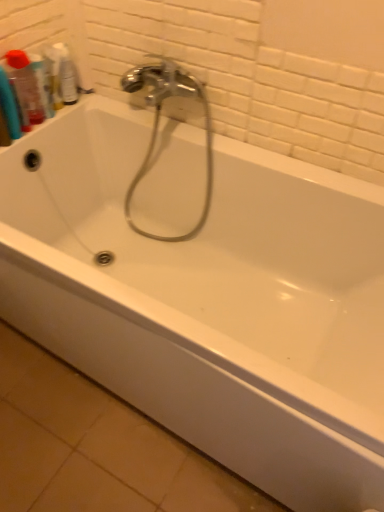
Question: From a real-world perspective, is translucent plastic mouthwash at upper left, which ranks as the first mouthwash in left-to-right order, positioned under translucent plastic mouthwash at upper left, arranged as the 2th mouthwash when viewed from the left, based on gravity?

Choices:
 (A) yes
 (B) no

Answer: (B)

Question: Considering the relative positions of translucent plastic mouthwash at upper left, which ranks as the first mouthwash in left-to-right order, and translucent plastic mouthwash at upper left, arranged as the second mouthwash when viewed from the right, in the image provided, is translucent plastic mouthwash at upper left, which ranks as the first mouthwash in left-to-right order, behind translucent plastic mouthwash at upper left, arranged as the second mouthwash when viewed from the right,?

Choices:
 (A) no
 (B) yes

Answer: (A)

Question: Is translucent plastic mouthwash at upper left, arranged as the 2th mouthwash when viewed from the left, located within translucent plastic mouthwash at upper left, which ranks as the first mouthwash in left-to-right order?

Choices:
 (A) no
 (B) yes

Answer: (A)

Question: Is translucent plastic mouthwash at upper left, which ranks as the first mouthwash in left-to-right order, aimed at translucent plastic mouthwash at upper left, arranged as the second mouthwash when viewed from the right?

Choices:
 (A) yes
 (B) no

Answer: (B)

Question: Is translucent plastic mouthwash at upper left, the 3th mouthwash in the right-to-left sequence, at the right side of translucent plastic mouthwash at upper left, arranged as the 2th mouthwash when viewed from the left?

Choices:
 (A) no
 (B) yes

Answer: (A)

Question: Considering their positions, is chrome metallic faucet at center located in front of or behind clear plastic bottle at upper left, which is counted as the 3th mouthwash, starting from the left?

Choices:
 (A) front
 (B) behind

Answer: (A)

Question: In the image, is chrome metallic faucet at center on the left side or the right side of clear plastic bottle at upper left, which is counted as the 3th mouthwash, starting from the left?

Choices:
 (A) right
 (B) left

Answer: (A)

Question: In terms of size, does chrome metallic faucet at center appear bigger or smaller than clear plastic bottle at upper left, which is counted as the 3th mouthwash, starting from the left?

Choices:
 (A) small
 (B) big

Answer: (B)

Question: From the image's perspective, relative to clear plastic bottle at upper left, which is counted as the 3th mouthwash, starting from the left, is chrome metallic faucet at center above or below?

Choices:
 (A) above
 (B) below

Answer: (B)

Question: Looking at their shapes, would you say chrome metallic faucet at center is wider or thinner than translucent plastic mouthwash at upper left, arranged as the second mouthwash when viewed from the right?

Choices:
 (A) thin
 (B) wide

Answer: (B)

Question: From the image's perspective, is chrome metallic faucet at center above or below translucent plastic mouthwash at upper left, arranged as the second mouthwash when viewed from the right?

Choices:
 (A) below
 (B) above

Answer: (A)

Question: Based on their sizes in the image, would you say chrome metallic faucet at center is bigger or smaller than translucent plastic mouthwash at upper left, arranged as the 2th mouthwash when viewed from the left?

Choices:
 (A) small
 (B) big

Answer: (B)

Question: Is chrome metallic faucet at center inside the boundaries of translucent plastic mouthwash at upper left, arranged as the second mouthwash when viewed from the right, or outside?

Choices:
 (A) inside
 (B) outside

Answer: (B)

Question: Is translucent plastic mouthwash at upper left, arranged as the second mouthwash when viewed from the right, inside the boundaries of chrome metallic faucet at center, or outside?

Choices:
 (A) inside
 (B) outside

Answer: (B)

Question: In terms of width, does translucent plastic mouthwash at upper left, arranged as the 2th mouthwash when viewed from the left, look wider or thinner when compared to chrome metallic faucet at center?

Choices:
 (A) thin
 (B) wide

Answer: (A)